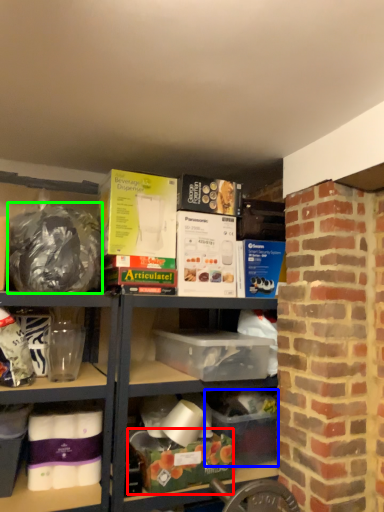
Question: Which object is the closest to the box (highlighted by a red box)? Choose among these: box (highlighted by a blue box) or waste (highlighted by a green box).

Choices:
 (A) box
 (B) waste

Answer: (A)